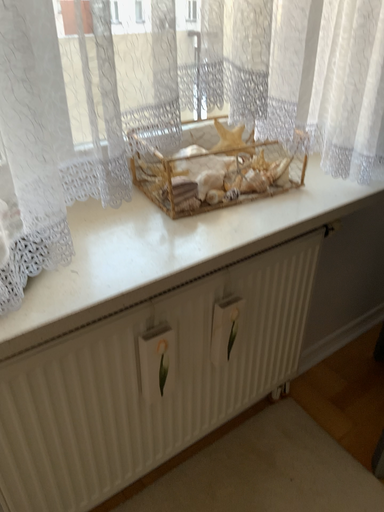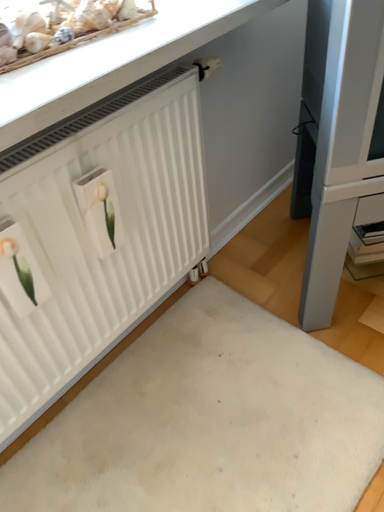
Question: Which way did the camera rotate in the video?

Choices:
 (A) rotated left
 (B) rotated right

Answer: (B)